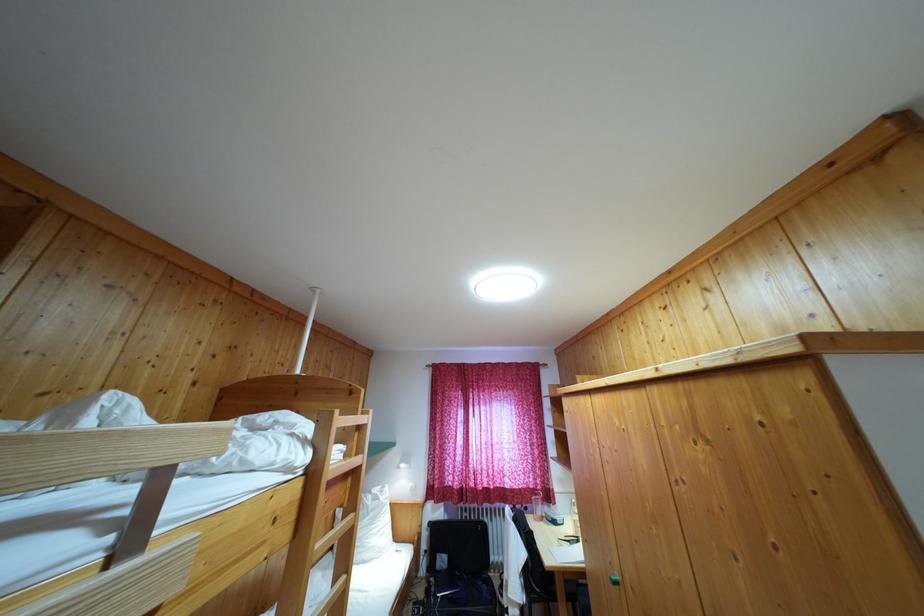
The location [537,506] corresponds to which object?

It refers to a clear water bottle.